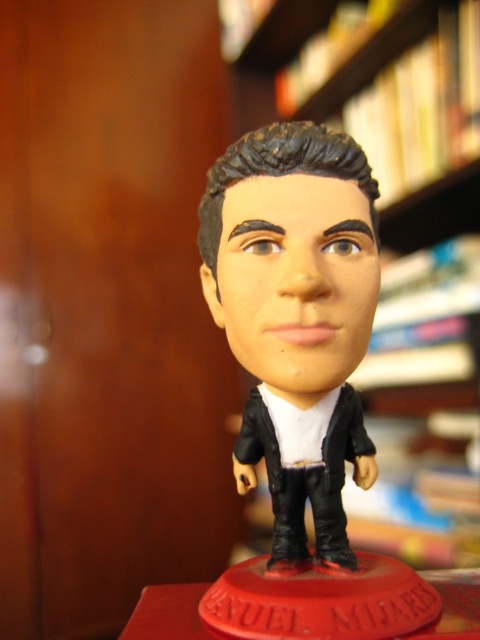
How distant is black matte business suit at center from wooden bookshelf at upper center?

black matte business suit at center and wooden bookshelf at upper center are 27.73 inches apart from each other.

Consider the image. Can you confirm if black matte business suit at center is positioned above wooden bookshelf at upper center?

No, black matte business suit at center is not above wooden bookshelf at upper center.

Where is `black matte business suit at center`? black matte business suit at center is located at coordinates (307, 477).